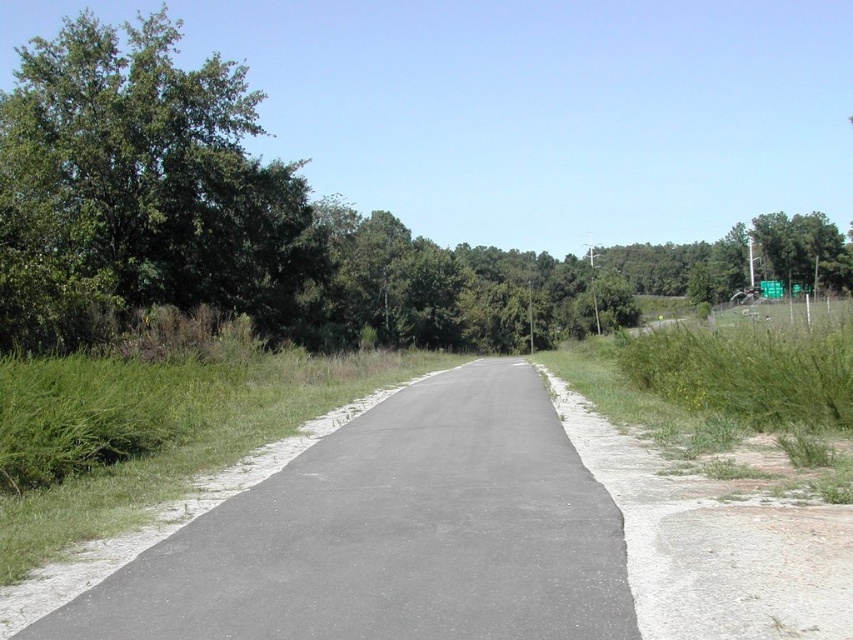
Question: Does green leafy tree at left have a smaller size compared to green metallic sign at upper right?

Choices:
 (A) yes
 (B) no

Answer: (B)

Question: Can you confirm if green leafy tree at left is wider than green metallic sign at upper right?

Choices:
 (A) no
 (B) yes

Answer: (B)

Question: Which point is closer to the camera?

Choices:
 (A) green metallic sign at upper right
 (B) gray asphalt path at center
 (C) green leafy tree at left

Answer: (B)

Question: Does gray asphalt path at center appear over green leafy tree at left?

Choices:
 (A) yes
 (B) no

Answer: (B)

Question: Which object appears closest to the camera in this image?

Choices:
 (A) green leafy tree at left
 (B) green metallic sign at upper right
 (C) gray asphalt path at center

Answer: (C)

Question: Which of the following is the closest to the observer?

Choices:
 (A) green metallic sign at upper right
 (B) green leafy tree at left

Answer: (B)